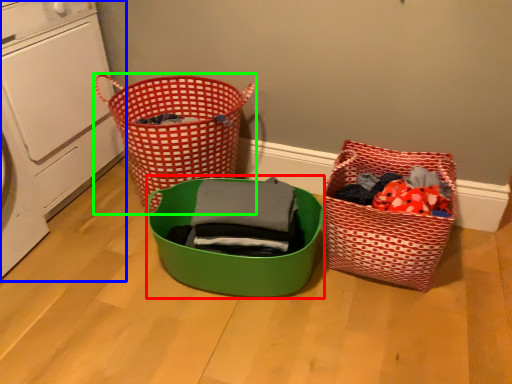
Question: Which object is the farthest from basket (highlighted by a red box)? Choose among these: washing machine (highlighted by a blue box) or waste container (highlighted by a green box).

Choices:
 (A) washing machine
 (B) waste container

Answer: (A)